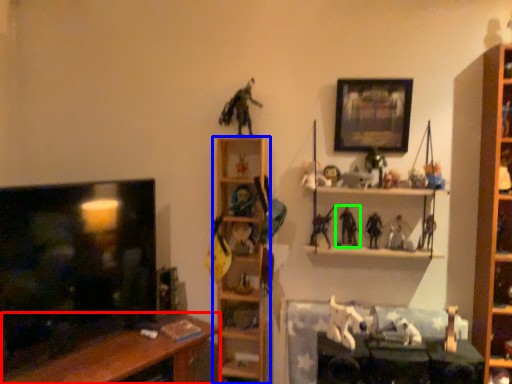
Question: Which is nearer to the table (highlighted by a red box)? shelf (highlighted by a blue box) or toy (highlighted by a green box).

Choices:
 (A) shelf
 (B) toy

Answer: (A)